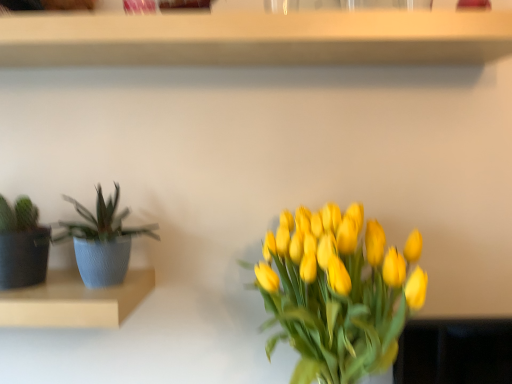
Find the location of `wooden shelf at upper center, positioned as the second shelf in bottom-to-top order`. wooden shelf at upper center, positioned as the second shelf in bottom-to-top order is located at coordinates (256, 38).

Describe the element at coordinates (256, 38) in the screenshot. I see `wooden shelf at upper center, positioned as the second shelf in bottom-to-top order` at that location.

Locate an element on the screen. The width and height of the screenshot is (512, 384). blue textured pot at left is located at coordinates (102, 240).

Locate an element on the screen. matte blue pot at left, placed as the 2th shelf when sorted from top to bottom is located at coordinates (74, 301).

Where is `wooden shelf at upper center, which ranks as the 1th shelf in top-to-bottom order`? wooden shelf at upper center, which ranks as the 1th shelf in top-to-bottom order is located at coordinates (256, 38).

Is wooden shelf at upper center, which ranks as the 1th shelf in top-to-bottom order, bigger than matte blue pot at left, which ranks as the 1th shelf in bottom-to-top order?

Indeed, wooden shelf at upper center, which ranks as the 1th shelf in top-to-bottom order, has a larger size compared to matte blue pot at left, which ranks as the 1th shelf in bottom-to-top order.

What's the angular difference between wooden shelf at upper center, positioned as the second shelf in bottom-to-top order, and matte blue pot at left, placed as the 2th shelf when sorted from top to bottom,'s facing directions?

The facing directions of wooden shelf at upper center, positioned as the second shelf in bottom-to-top order, and matte blue pot at left, placed as the 2th shelf when sorted from top to bottom, are 0.518 degrees apart.

Between wooden shelf at upper center, positioned as the second shelf in bottom-to-top order, and matte blue pot at left, which ranks as the 1th shelf in bottom-to-top order, which one has larger width?

With larger width is matte blue pot at left, which ranks as the 1th shelf in bottom-to-top order.

Can matte blue pot at left, which ranks as the 1th shelf in bottom-to-top order, be found inside wooden shelf at upper center, which ranks as the 1th shelf in top-to-bottom order?

No, matte blue pot at left, which ranks as the 1th shelf in bottom-to-top order, is not a part of wooden shelf at upper center, which ranks as the 1th shelf in top-to-bottom order.

Who is smaller, blue textured pot at left or matte blue pot at left, which ranks as the 1th shelf in bottom-to-top order?

matte blue pot at left, which ranks as the 1th shelf in bottom-to-top order, is smaller.

You are a GUI agent. You are given a task and a screenshot of the screen. Output one action in this format:
    pyautogui.click(x=<x>, y=<y>)
    Task: Click on the shelf located underneath the blue textured pot at left (from a real-world perspective)
    This screenshot has width=512, height=384.
    Given the screenshot: What is the action you would take?
    [74, 301]

Does blue textured pot at left have a greater height compared to matte blue pot at left, placed as the 2th shelf when sorted from top to bottom?

Indeed, blue textured pot at left has a greater height compared to matte blue pot at left, placed as the 2th shelf when sorted from top to bottom.

Looking at their sizes, would you say blue textured pot at left is wider or thinner than matte blue pot at left, which ranks as the 1th shelf in bottom-to-top order?

Clearly, blue textured pot at left has less width compared to matte blue pot at left, which ranks as the 1th shelf in bottom-to-top order.

Is blue textured pot at left taller than wooden shelf at upper center, which ranks as the 1th shelf in top-to-bottom order?

Indeed, blue textured pot at left has a greater height compared to wooden shelf at upper center, which ranks as the 1th shelf in top-to-bottom order.

From the image's perspective, which one is positioned lower, blue textured pot at left or wooden shelf at upper center, which ranks as the 1th shelf in top-to-bottom order?

blue textured pot at left is shown below in the image.

Which object is wider, blue textured pot at left or wooden shelf at upper center, which ranks as the 1th shelf in top-to-bottom order?

With larger width is wooden shelf at upper center, which ranks as the 1th shelf in top-to-bottom order.

Can you confirm if blue textured pot at left is smaller than wooden shelf at upper center, positioned as the second shelf in bottom-to-top order?

Indeed, blue textured pot at left has a smaller size compared to wooden shelf at upper center, positioned as the second shelf in bottom-to-top order.

Can you tell me how much matte blue pot at left, which ranks as the 1th shelf in bottom-to-top order, and wooden shelf at upper center, positioned as the second shelf in bottom-to-top order, differ in facing direction?

matte blue pot at left, which ranks as the 1th shelf in bottom-to-top order, and wooden shelf at upper center, positioned as the second shelf in bottom-to-top order, are facing 0.518 degrees away from each other.

Is wooden shelf at upper center, which ranks as the 1th shelf in top-to-bottom order, a part of matte blue pot at left, placed as the 2th shelf when sorted from top to bottom?

No, wooden shelf at upper center, which ranks as the 1th shelf in top-to-bottom order, is located outside of matte blue pot at left, placed as the 2th shelf when sorted from top to bottom.

Is matte blue pot at left, which ranks as the 1th shelf in bottom-to-top order, beside wooden shelf at upper center, positioned as the second shelf in bottom-to-top order?

No, matte blue pot at left, which ranks as the 1th shelf in bottom-to-top order, is not with wooden shelf at upper center, positioned as the second shelf in bottom-to-top order.

Is matte blue pot at left, placed as the 2th shelf when sorted from top to bottom, wider than wooden shelf at upper center, positioned as the second shelf in bottom-to-top order?

Yes, matte blue pot at left, placed as the 2th shelf when sorted from top to bottom, is wider than wooden shelf at upper center, positioned as the second shelf in bottom-to-top order.

Considering their positions, is matte blue pot at left, placed as the 2th shelf when sorted from top to bottom, located in front of or behind blue textured pot at left?

matte blue pot at left, placed as the 2th shelf when sorted from top to bottom, is positioned closer to the viewer than blue textured pot at left.

Can blue textured pot at left be found inside matte blue pot at left, which ranks as the 1th shelf in bottom-to-top order?

That's incorrect, blue textured pot at left is not inside matte blue pot at left, which ranks as the 1th shelf in bottom-to-top order.

Where is `shelf located on the left of blue textured pot at left`? Image resolution: width=512 pixels, height=384 pixels. shelf located on the left of blue textured pot at left is located at coordinates (74, 301).

From the image's perspective, is matte blue pot at left, which ranks as the 1th shelf in bottom-to-top order, above blue textured pot at left?

Actually, matte blue pot at left, which ranks as the 1th shelf in bottom-to-top order, appears below blue textured pot at left in the image.

Where is `shelf positioned vertically above the blue textured pot at left (from a real-world perspective)`? shelf positioned vertically above the blue textured pot at left (from a real-world perspective) is located at coordinates (256, 38).

Are wooden shelf at upper center, which ranks as the 1th shelf in top-to-bottom order, and blue textured pot at left located far from each other?

No, wooden shelf at upper center, which ranks as the 1th shelf in top-to-bottom order, is not far away from blue textured pot at left.

How much distance is there between wooden shelf at upper center, positioned as the second shelf in bottom-to-top order, and blue textured pot at left?

The distance of wooden shelf at upper center, positioned as the second shelf in bottom-to-top order, from blue textured pot at left is 17.98 inches.

Is wooden shelf at upper center, positioned as the second shelf in bottom-to-top order, further to the viewer compared to blue textured pot at left?

No, the depth of wooden shelf at upper center, positioned as the second shelf in bottom-to-top order, is less than that of blue textured pot at left.

This screenshot has height=384, width=512. Identify the location of shelf on the right side of matte blue pot at left, which ranks as the 1th shelf in bottom-to-top order. (256, 38).

Image resolution: width=512 pixels, height=384 pixels. Find the location of `houseplant that appears behind the matte blue pot at left, which ranks as the 1th shelf in bottom-to-top order`. houseplant that appears behind the matte blue pot at left, which ranks as the 1th shelf in bottom-to-top order is located at coordinates (102, 240).

Considering their positions, is wooden shelf at upper center, positioned as the second shelf in bottom-to-top order, positioned closer to blue textured pot at left than matte blue pot at left, which ranks as the 1th shelf in bottom-to-top order?

Based on the image, matte blue pot at left, which ranks as the 1th shelf in bottom-to-top order, appears to be nearer to blue textured pot at left.

Estimate the real-world distances between objects in this image. Which object is further from wooden shelf at upper center, positioned as the second shelf in bottom-to-top order, matte blue pot at left, which ranks as the 1th shelf in bottom-to-top order, or blue textured pot at left?

Among the two, matte blue pot at left, which ranks as the 1th shelf in bottom-to-top order, is located further to wooden shelf at upper center, positioned as the second shelf in bottom-to-top order.

Looking at the image, which one is located further to matte blue pot at left, placed as the 2th shelf when sorted from top to bottom, wooden shelf at upper center, positioned as the second shelf in bottom-to-top order, or blue textured pot at left?

wooden shelf at upper center, positioned as the second shelf in bottom-to-top order.

Considering their positions, is blue textured pot at left positioned further to wooden shelf at upper center, which ranks as the 1th shelf in top-to-bottom order, than matte blue pot at left, which ranks as the 1th shelf in bottom-to-top order?

matte blue pot at left, which ranks as the 1th shelf in bottom-to-top order, is further to wooden shelf at upper center, which ranks as the 1th shelf in top-to-bottom order.

Estimate the real-world distances between objects in this image. Which object is closer to blue textured pot at left, matte blue pot at left, which ranks as the 1th shelf in bottom-to-top order, or wooden shelf at upper center, positioned as the second shelf in bottom-to-top order?

matte blue pot at left, which ranks as the 1th shelf in bottom-to-top order, is positioned closer to the anchor blue textured pot at left.

In the scene shown: Which object lies further to the anchor point matte blue pot at left, which ranks as the 1th shelf in bottom-to-top order, blue textured pot at left or wooden shelf at upper center, which ranks as the 1th shelf in top-to-bottom order?

wooden shelf at upper center, which ranks as the 1th shelf in top-to-bottom order, lies further to matte blue pot at left, which ranks as the 1th shelf in bottom-to-top order, than the other object.

Locate an element on the screen. Image resolution: width=512 pixels, height=384 pixels. houseplant between wooden shelf at upper center, positioned as the second shelf in bottom-to-top order, and matte blue pot at left, placed as the 2th shelf when sorted from top to bottom, from top to bottom is located at coordinates (102, 240).